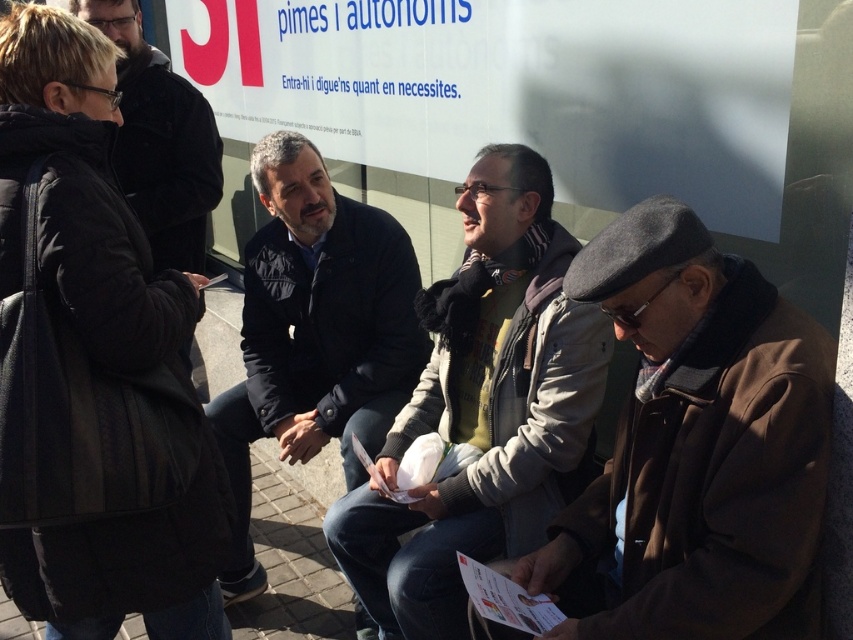
Can you confirm if light gray jacket at center is thinner than black matte jacket at upper left?

In fact, light gray jacket at center might be wider than black matte jacket at upper left.

Between light gray jacket at center and black matte jacket at upper left, which one appears on the right side from the viewer's perspective?

From the viewer's perspective, light gray jacket at center appears more on the right side.

Which is in front, point (500, 268) or point (138, 20)?

Point (500, 268) is more forward.

Locate an element on the screen. This screenshot has width=853, height=640. light gray jacket at center is located at coordinates pos(483,408).

Does point (775, 305) lie in front of point (404, 596)?

Yes.

The width and height of the screenshot is (853, 640). In order to click on brown woolen jacket at center in this screenshot , I will do `click(695, 449)`.

Looking at this image, is dark blue jacket at center closer to camera compared to black matte jacket at upper left?

Yes.

Is dark blue jacket at center to the right of black matte jacket at upper left from the viewer's perspective?

Correct, you'll find dark blue jacket at center to the right of black matte jacket at upper left.

Image resolution: width=853 pixels, height=640 pixels. Find the location of `dark blue jacket at center`. dark blue jacket at center is located at coordinates (314, 332).

In order to click on dark blue jacket at center in this screenshot , I will do `click(314, 332)`.